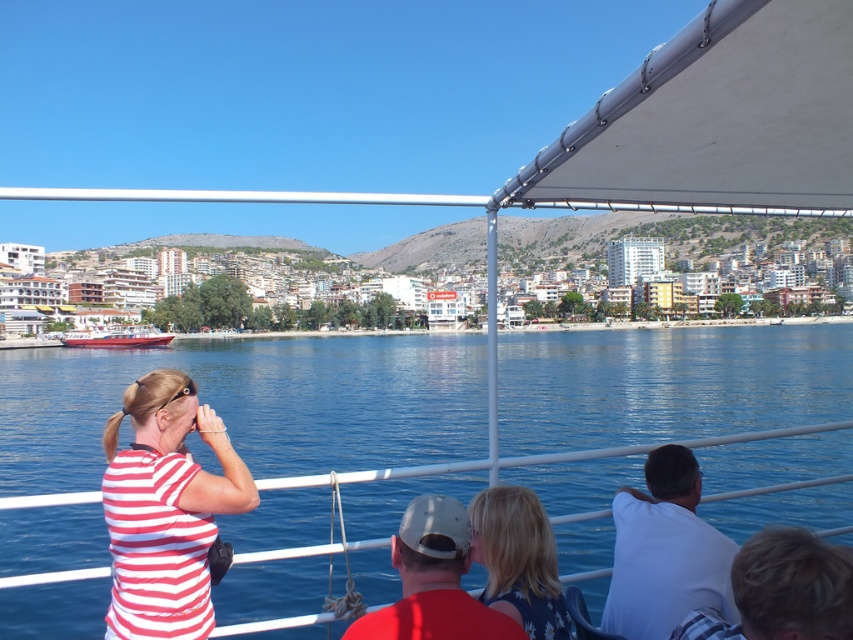
Question: Observing the image, what is the correct spatial positioning of striped cotton shirt at left in reference to white cotton shirt at lower right?

Choices:
 (A) left
 (B) right

Answer: (A)

Question: Among these points, which one is farthest from the camera?

Choices:
 (A) (456, 634)
 (B) (242, 348)

Answer: (B)

Question: Is white fabric canopy at upper right closer to the viewer compared to white cotton shirt at lower right?

Choices:
 (A) yes
 (B) no

Answer: (A)

Question: Is striped cotton shirt at left bigger than dark blue fabric at lower center?

Choices:
 (A) yes
 (B) no

Answer: (A)

Question: Which point appears farthest from the camera in this image?

Choices:
 (A) (440, 573)
 (B) (834, 112)

Answer: (B)

Question: Which point is closer to the camera?

Choices:
 (A) dark blue floral dress at center
 (B) blue water at center
 (C) striped cotton shirt at left
 (D) white fabric canopy at upper right

Answer: (D)